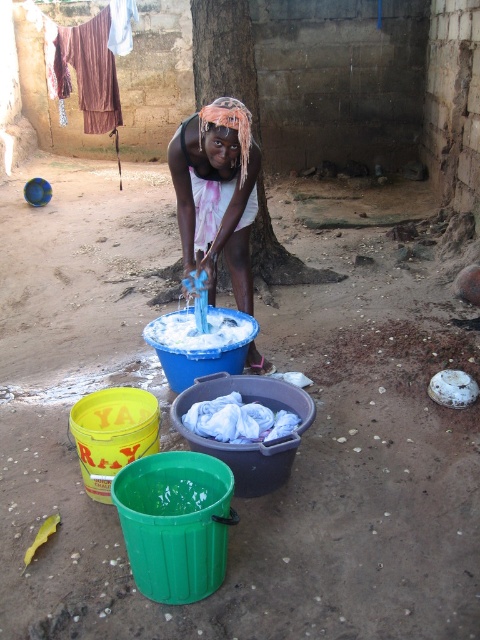
Which of these two, white fabric at center or brown rough tree trunk at center, stands shorter?

Standing shorter between the two is brown rough tree trunk at center.

Is white fabric at center positioned before brown rough tree trunk at center?

Yes, it is in front of brown rough tree trunk at center.

Is point (186, 124) positioned before point (233, 93)?

Yes, point (186, 124) is in front of point (233, 93).

Locate an element on the screen. white fabric at center is located at coordinates (216, 193).